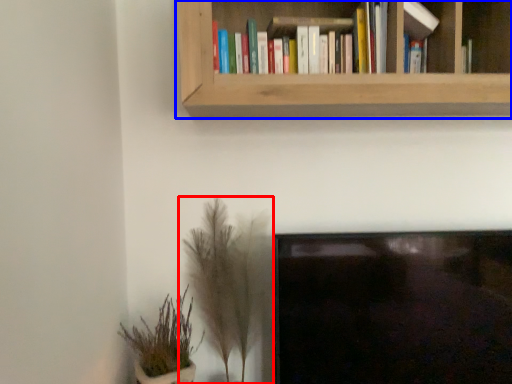
Question: Which of the following is the closest to the observer, houseplant (highlighted by a red box) or bookcase (highlighted by a blue box)?

Choices:
 (A) houseplant
 (B) bookcase

Answer: (B)